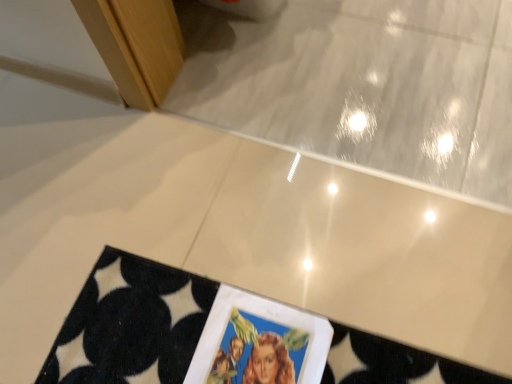
Identify the location of vacant position to the left of white glossy tablet at center. This screenshot has width=512, height=384. (x=113, y=341).